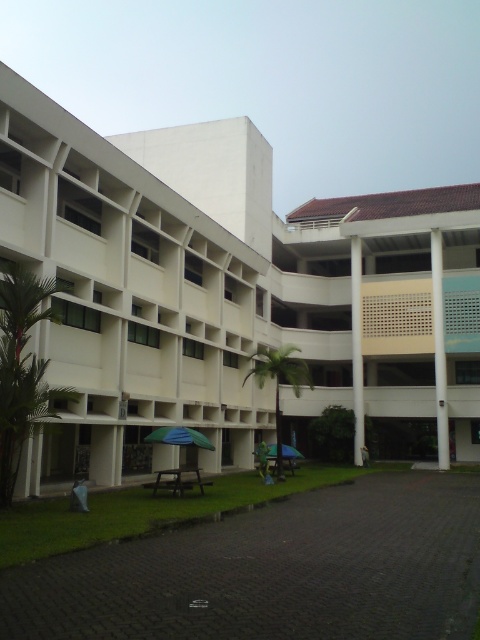
Which is above, white smooth building at center or green fabric umbrella at lower center?

white smooth building at center is above.

Is white smooth building at center closer to the viewer compared to green fabric umbrella at lower center?

Yes, it is.

The width and height of the screenshot is (480, 640). What do you see at coordinates (230, 294) in the screenshot?
I see `white smooth building at center` at bounding box center [230, 294].

Where is `white smooth building at center`? white smooth building at center is located at coordinates (230, 294).